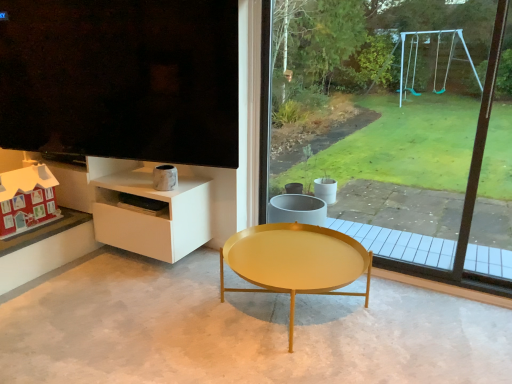
This screenshot has width=512, height=384. Find the location of `free point below gold metallic coffee table at center (from a real-world perspective)`. free point below gold metallic coffee table at center (from a real-world perspective) is located at coordinates (298, 310).